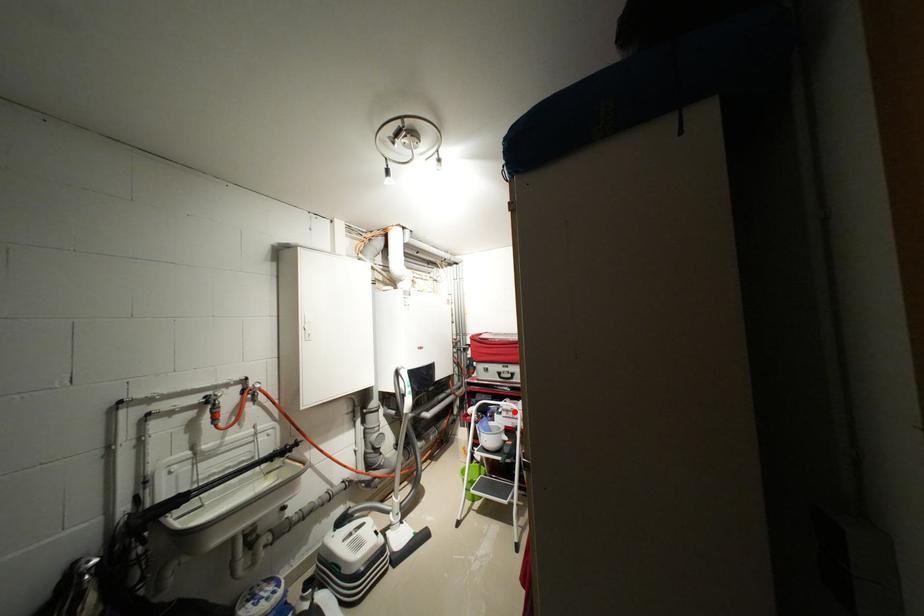
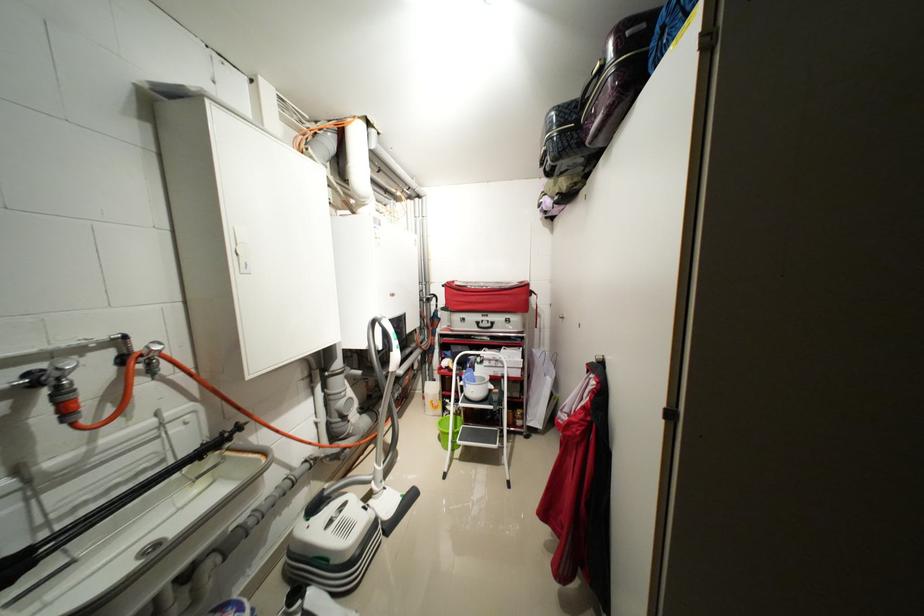
The point at the highlighted location is marked in the first image. Where is the corresponding point in the second image?

(496, 361)